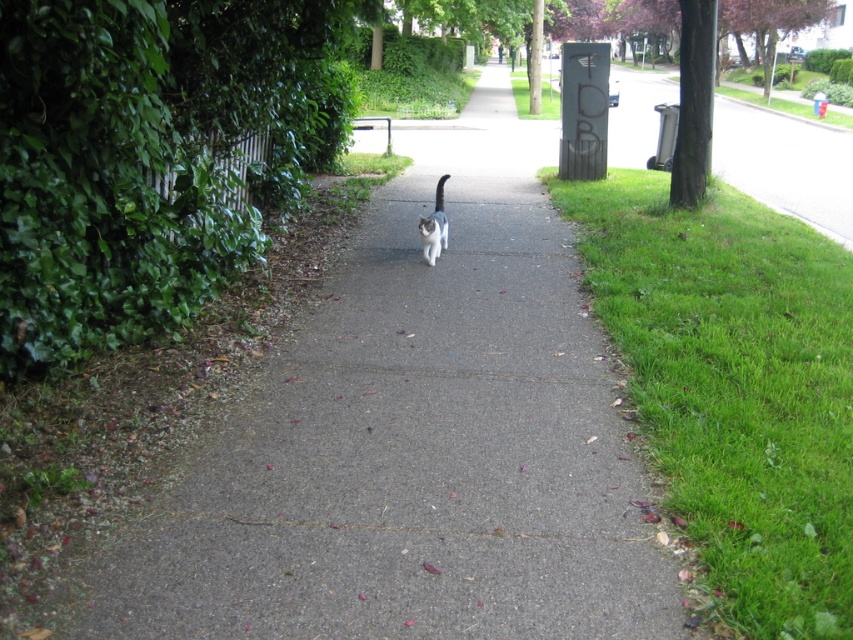
Can you confirm if green leafy hedge at left is bigger than white fur cat at center?

Correct, green leafy hedge at left is larger in size than white fur cat at center.

Is point (177, 228) less distant than point (430, 248)?

Yes, it is.

Where is `green leafy hedge at left`? The image size is (853, 640). green leafy hedge at left is located at coordinates (x=149, y=156).

Does gray asphalt pavement at center have a greater width compared to white fur cat at center?

Indeed, gray asphalt pavement at center has a greater width compared to white fur cat at center.

Is gray asphalt pavement at center thinner than white fur cat at center?

No, gray asphalt pavement at center is not thinner than white fur cat at center.

Which is behind, point (132, 545) or point (444, 230)?

The point (444, 230) is behind.

Where is `gray asphalt pavement at center`? Image resolution: width=853 pixels, height=640 pixels. gray asphalt pavement at center is located at coordinates (416, 442).

Can you confirm if gray asphalt pavement at center is smaller than green grass at lower right?

Incorrect, gray asphalt pavement at center is not smaller in size than green grass at lower right.

Is gray asphalt pavement at center below green grass at lower right?

Actually, gray asphalt pavement at center is above green grass at lower right.

Between point (334, 509) and point (792, 221), which one is positioned behind?

The point (792, 221) is behind.

Where is `gray asphalt pavement at center`? The height and width of the screenshot is (640, 853). gray asphalt pavement at center is located at coordinates (416, 442).